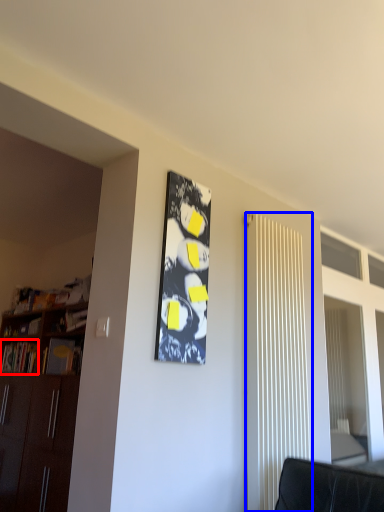
Question: Which object is further to the camera taking this photo, book (highlighted by a red box) or radiator (highlighted by a blue box)?

Choices:
 (A) book
 (B) radiator

Answer: (A)